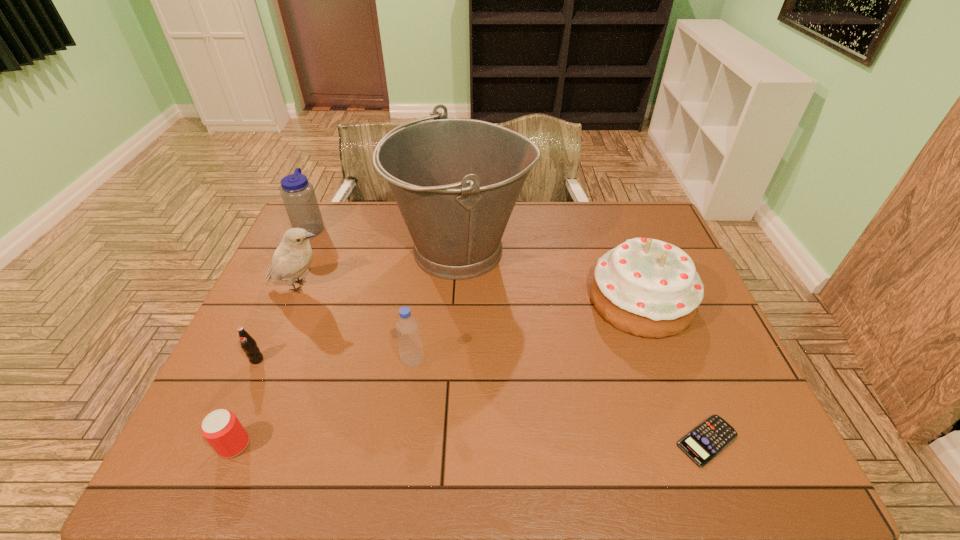
Find the location of a particular element. blank space located 0.080m with a carrying loop on the side of the water bottle is located at coordinates (348, 227).

The height and width of the screenshot is (540, 960). I want to click on vacant space located on the back of the cake, so click(609, 214).

At what (x,y) coordinates should I click in order to perform the action: click on free space located on the back of the bottle. Please return your answer as a coordinate pair (x, y). This screenshot has width=960, height=540. Looking at the image, I should click on (424, 278).

Image resolution: width=960 pixels, height=540 pixels. Find the location of `vacant space located 0.210m on the front label of the pop`. vacant space located 0.210m on the front label of the pop is located at coordinates (219, 443).

Locate an element on the screen. vacant space located on the back of the seventh tallest object is located at coordinates (282, 332).

You are a GUI agent. You are given a task and a screenshot of the screen. Output one action in this format:
    pyautogui.click(x=<x>, y=<y>)
    Task: Click on the free spot located 0.230m on the back of the shortest object
    
    Given the screenshot: What is the action you would take?
    pyautogui.click(x=667, y=339)

This screenshot has height=540, width=960. I want to click on bucket at the far edge, so click(x=456, y=181).

Locate an element on the screen. water bottle that is at the far edge is located at coordinates (298, 195).

Locate an element on the screen. beer can present at the near edge is located at coordinates (221, 428).

I want to click on calculator present at the near edge, so click(x=703, y=443).